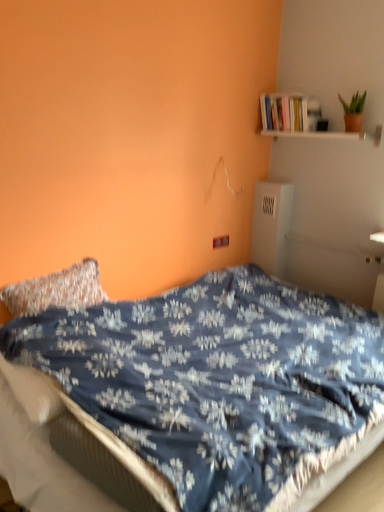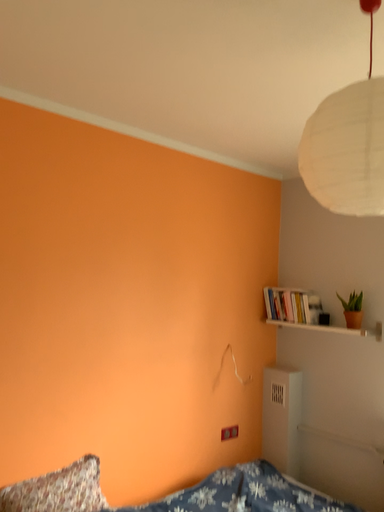
Question: Which way did the camera rotate in the video?

Choices:
 (A) rotated upward
 (B) rotated downward

Answer: (A)